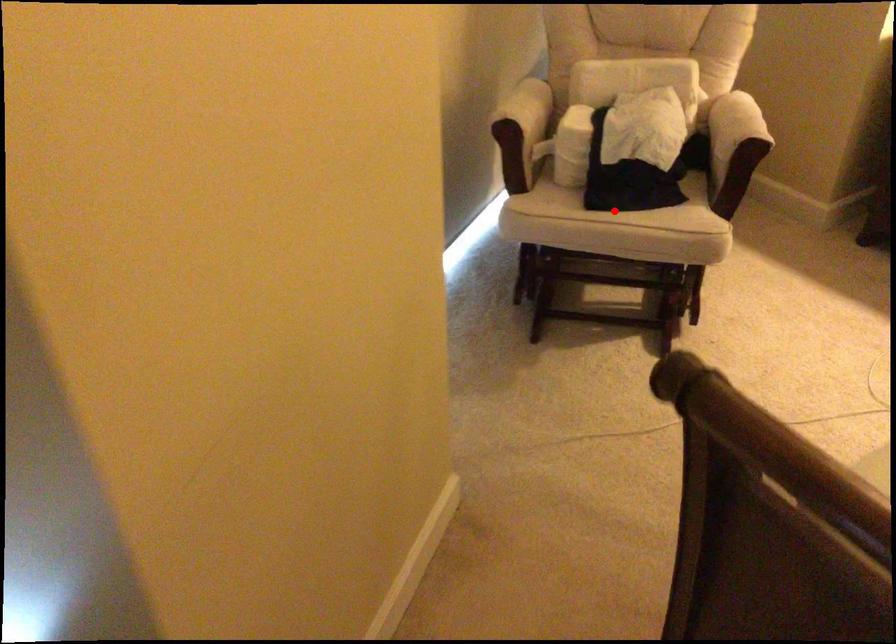
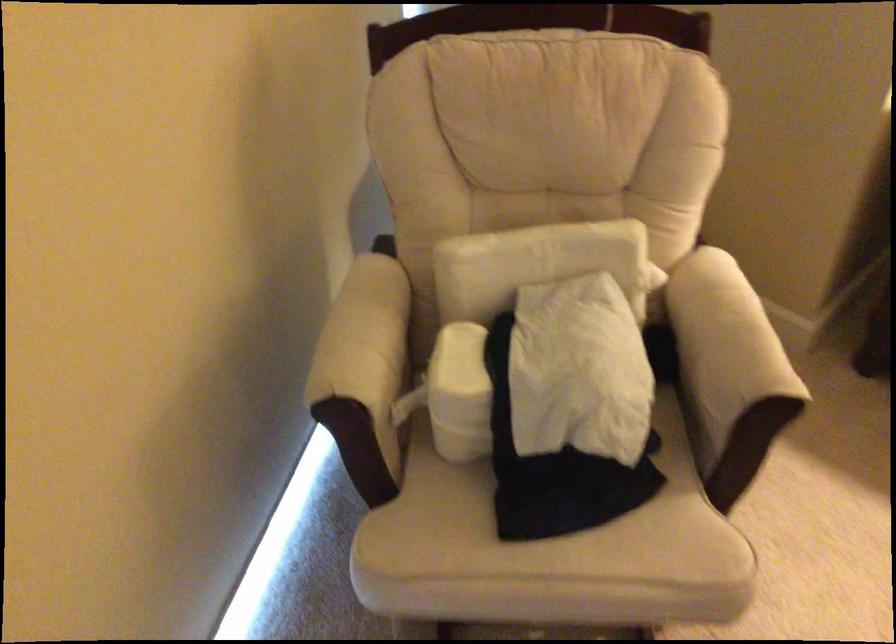
Find the pixel in the second image that matches the highlighted location in the first image.

(545, 535)